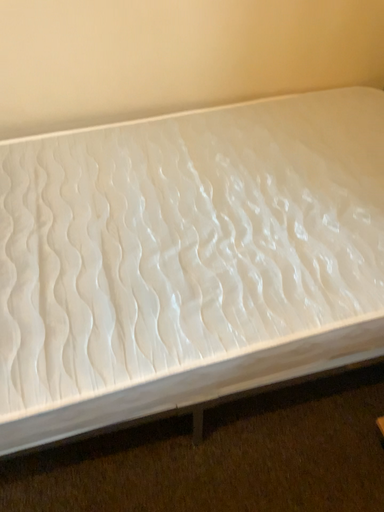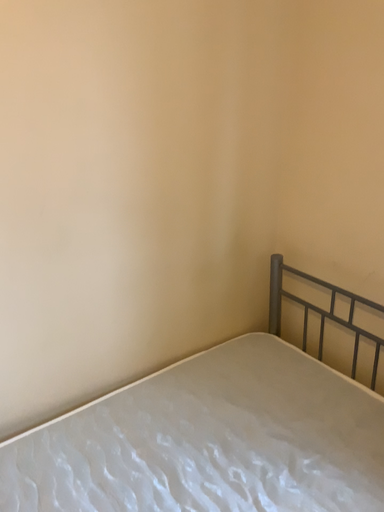
Question: How did the camera likely rotate when shooting the video?

Choices:
 (A) rotated downward
 (B) rotated upward

Answer: (B)